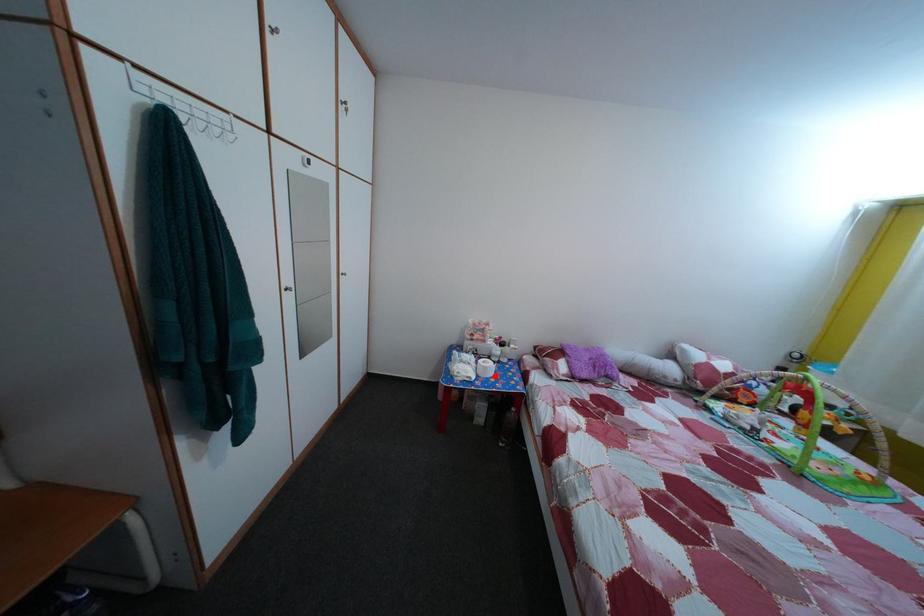
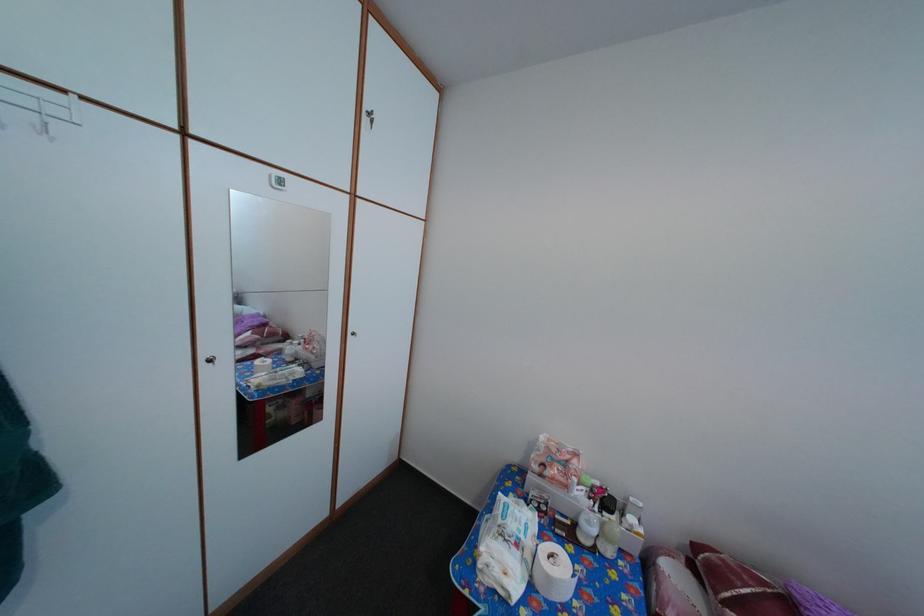
In the second image, find the point that corresponds to the highlighted location in the first image.

(558, 586)